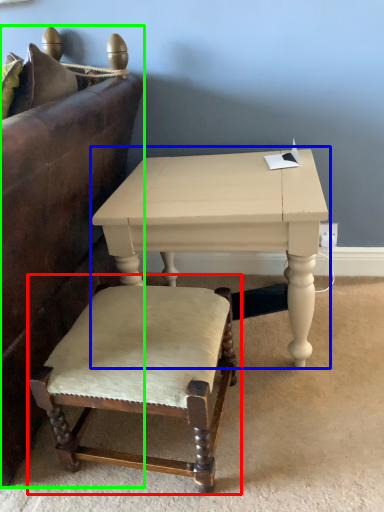
Question: Which is nearer to the chair (highlighted by a red box)? table (highlighted by a blue box) or studio couch (highlighted by a green box).

Choices:
 (A) table
 (B) studio couch

Answer: (A)